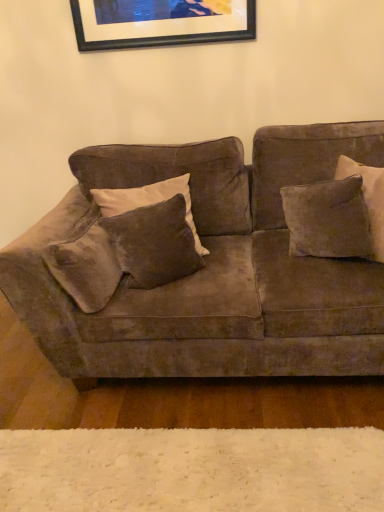
At what (x,y) coordinates should I click in order to perform the action: click on vacant point above white fluffy rug at lower center (from a real-world perspective). Please return your answer as a coordinate pair (x, y). Looking at the image, I should click on (150, 464).